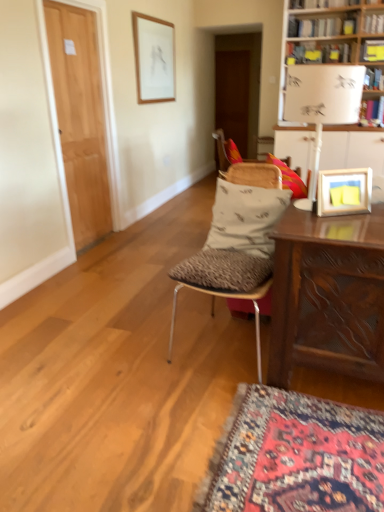
Locate an element on the screen. The image size is (384, 512). vacant space in front of mahogany wood desk at right is located at coordinates (316, 448).